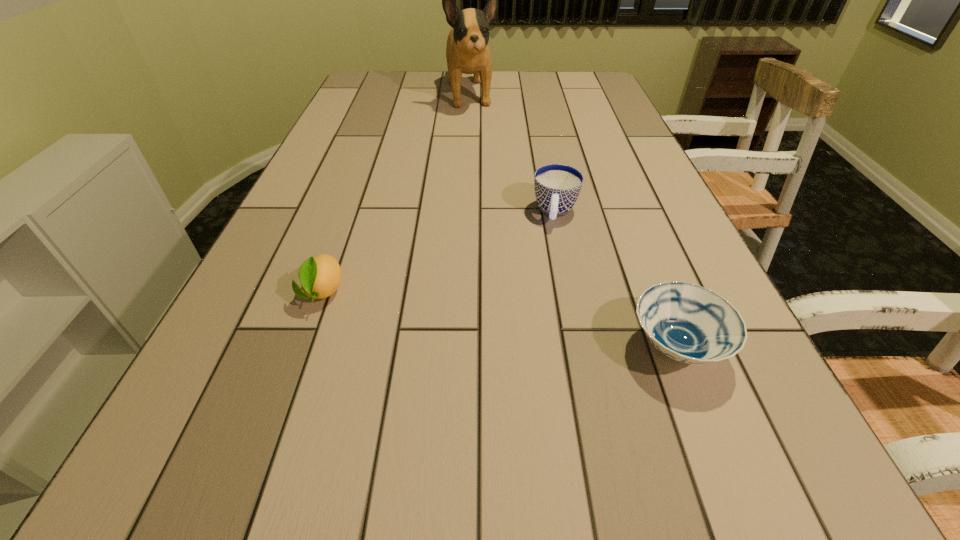
Where is `free space on the desktop that is between the lemon and the rightmost object and is positioned at the face of the puppy`? The height and width of the screenshot is (540, 960). free space on the desktop that is between the lemon and the rightmost object and is positioned at the face of the puppy is located at coordinates (539, 326).

What are the coordinates of `free spot on the desktop that is between the lemon and the rightmost object and is positioned on the side of the cup with the handle` in the screenshot? It's located at (540, 326).